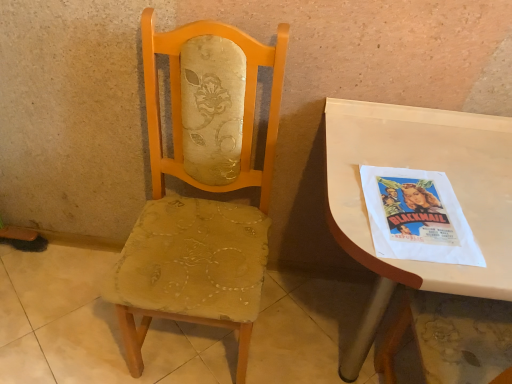
Identify the location of vacant space that is to the left of matte yellow fabric chair at center. (72, 320).